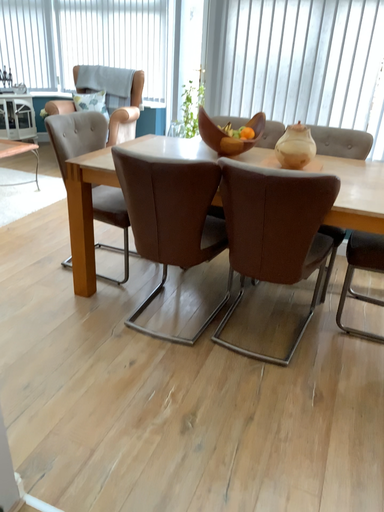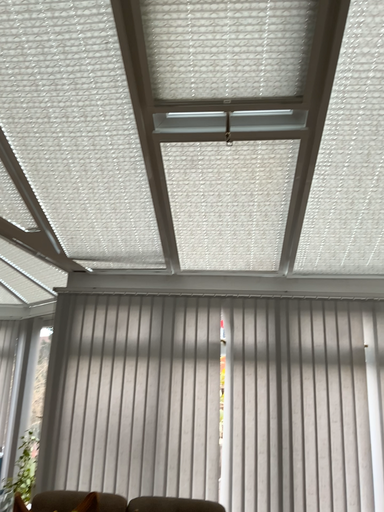
Question: How did the camera likely rotate when shooting the video?

Choices:
 (A) rotated right
 (B) rotated left

Answer: (A)